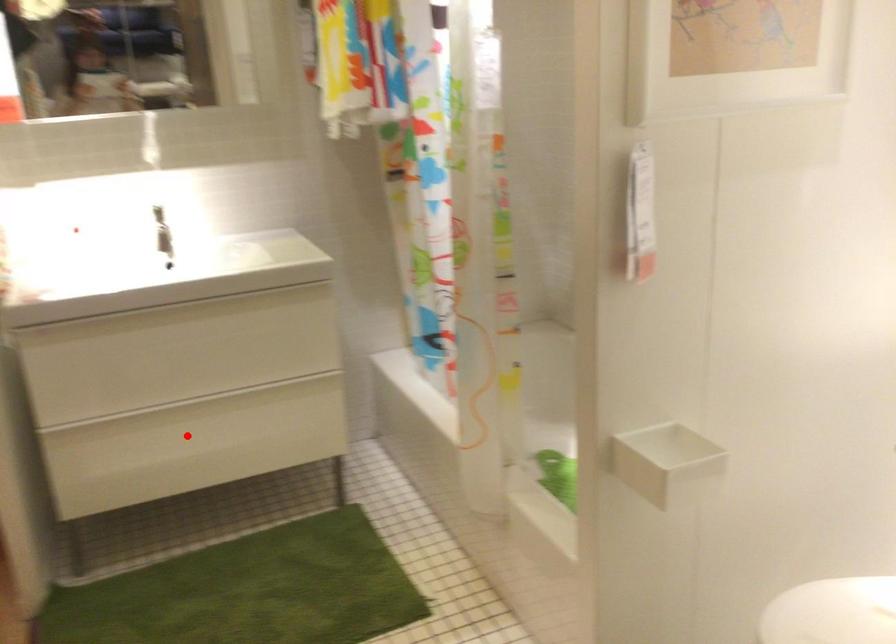
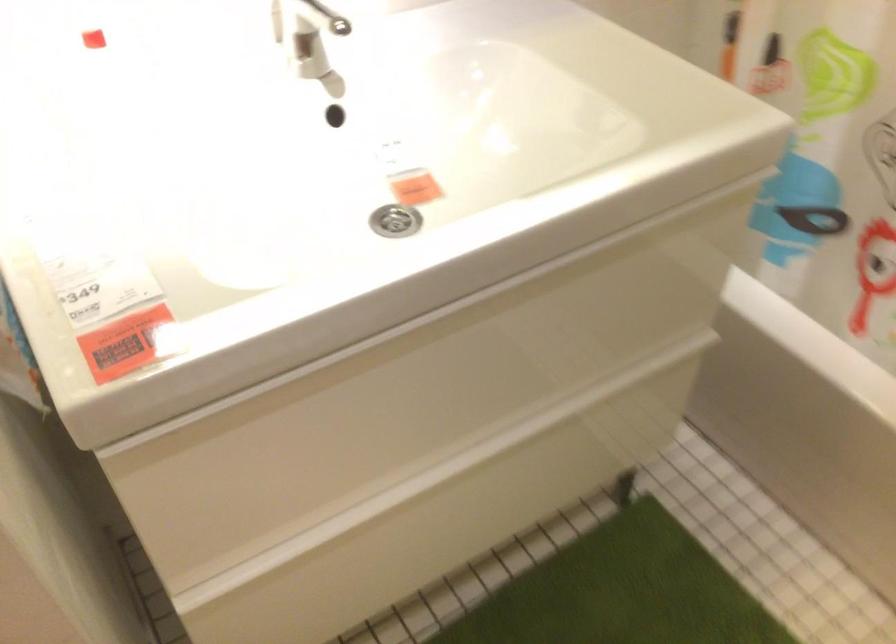
Find the pixel in the second image that matches the highlighted location in the first image.

(442, 514)